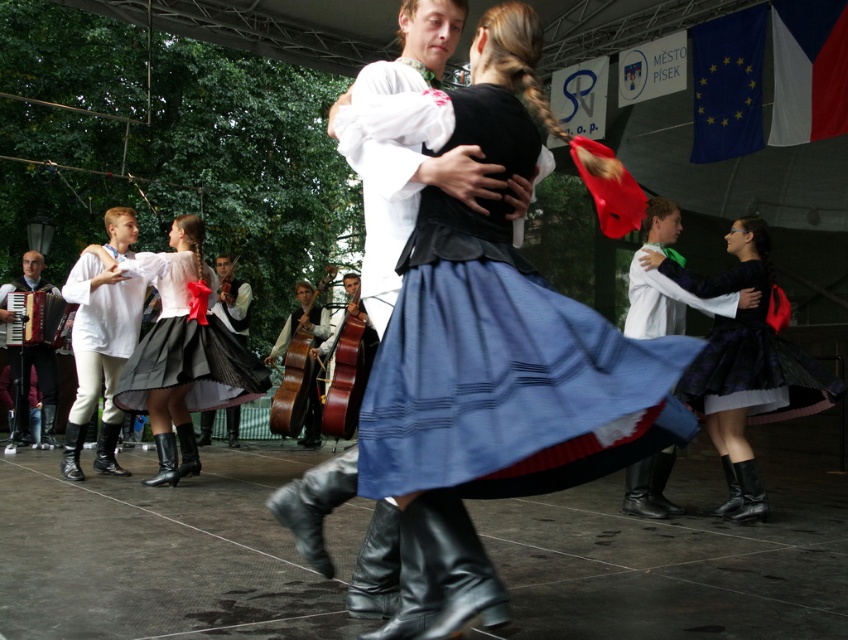
Is point (24, 444) behind point (24, 298)?

That is True.

Between matte white accordion at left and matte black accordion at left, which one appears on the left side from the viewer's perspective?

Positioned to the left is matte white accordion at left.

This screenshot has width=848, height=640. I want to click on matte white accordion at left, so click(x=38, y=388).

Is point (71, 416) in front of point (46, 384)?

Yes.

Is white cotton shirt at left closer to the viewer compared to matte white accordion at left?

Yes, white cotton shirt at left is closer to the viewer.

Locate an element on the screen. The width and height of the screenshot is (848, 640). white cotton shirt at left is located at coordinates (99, 333).

Where is `white cotton shirt at left`? This screenshot has width=848, height=640. white cotton shirt at left is located at coordinates (99, 333).

Does blue cotton skirt at center appear under black satin skirt at right?

No, blue cotton skirt at center is not below black satin skirt at right.

Does blue cotton skirt at center have a greater width compared to black satin skirt at right?

No.

Between point (519, 289) and point (715, 339), which one is positioned behind?

The point (715, 339) is more distant.

Identify the location of blue cotton skirt at center. (505, 372).